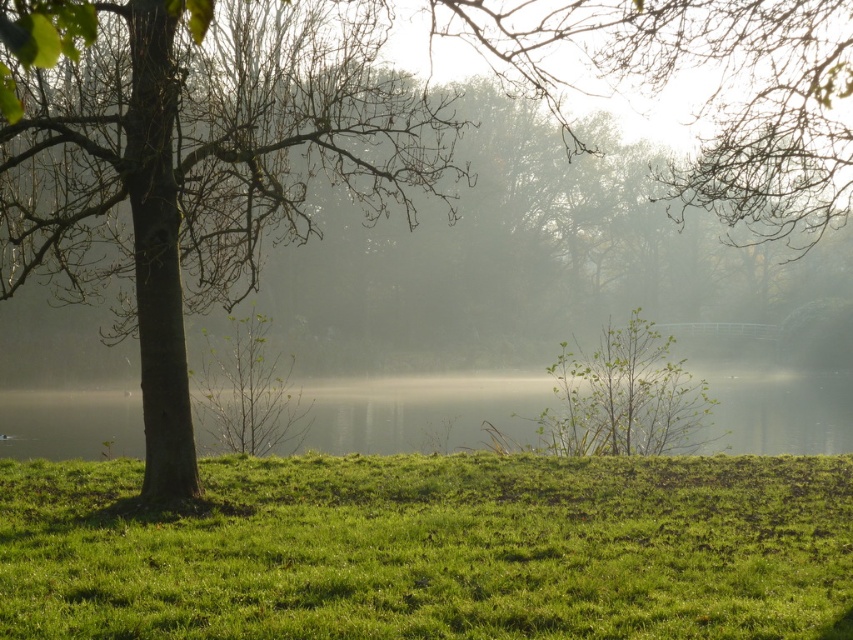
Question: Observing the image, what is the correct spatial positioning of green grassy at lower left in reference to green water at center?

Choices:
 (A) right
 (B) left

Answer: (B)

Question: Which point is closer to the camera?

Choices:
 (A) green water at center
 (B) green grassy at lower left

Answer: (B)

Question: Which point is farther to the camera?

Choices:
 (A) green grassy at lower left
 (B) green water at center

Answer: (B)

Question: Can you confirm if green grassy at lower left is positioned to the right of green water at center?

Choices:
 (A) yes
 (B) no

Answer: (B)

Question: Is green grassy at lower left above green water at center?

Choices:
 (A) yes
 (B) no

Answer: (A)